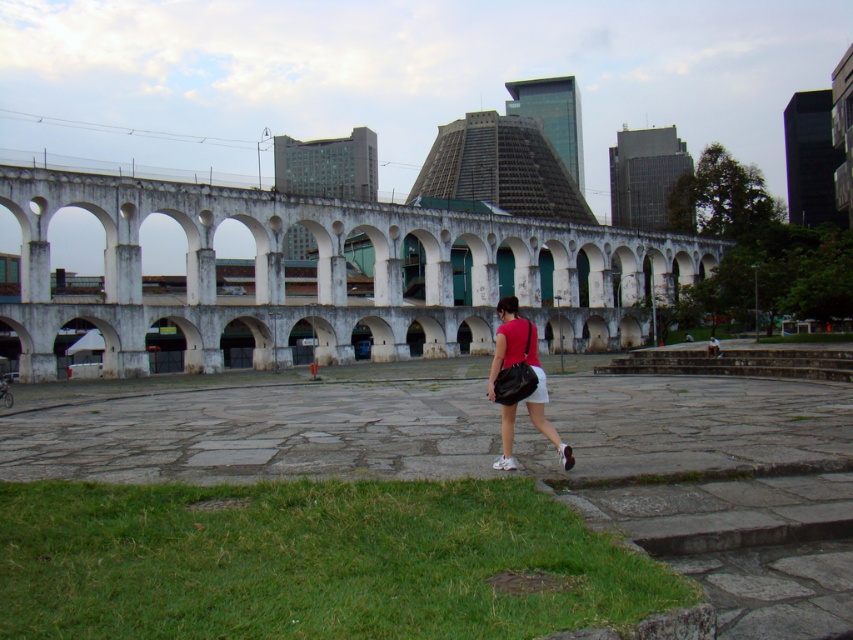
Can you confirm if matte black bag at center is positioned above white cotton shorts at lower center?

Correct, matte black bag at center is located above white cotton shorts at lower center.

Who is more distant from viewer, (502,355) or (532,401)?

The point (502,355) is behind.

Locate an element on the screen. The height and width of the screenshot is (640, 853). matte black bag at center is located at coordinates (527, 364).

Can you confirm if green grass at lower left is positioned above matte black bag at center?

No.

Is green grass at lower left positioned at the back of matte black bag at center?

No, green grass at lower left is closer to the viewer.

Where is `green grass at lower left`? The height and width of the screenshot is (640, 853). green grass at lower left is located at coordinates (312, 561).

At what (x,y) coordinates should I click in order to perform the action: click on green grass at lower left. Please return your answer as a coordinate pair (x, y). The height and width of the screenshot is (640, 853). Looking at the image, I should click on (312, 561).

Who is more forward, (663, 596) or (537, 384)?

Positioned in front is point (663, 596).

Who is taller, green grass at lower left or white cotton shorts at lower center?

With more height is green grass at lower left.

Where is `green grass at lower left`? The image size is (853, 640). green grass at lower left is located at coordinates (312, 561).